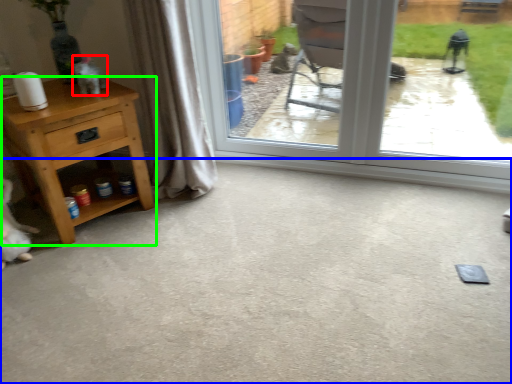
Question: Considering the real-world distances, which object is farthest from animal (highlighted by a red box)? concrete (highlighted by a blue box) or nightstand (highlighted by a green box)?

Choices:
 (A) concrete
 (B) nightstand

Answer: (A)